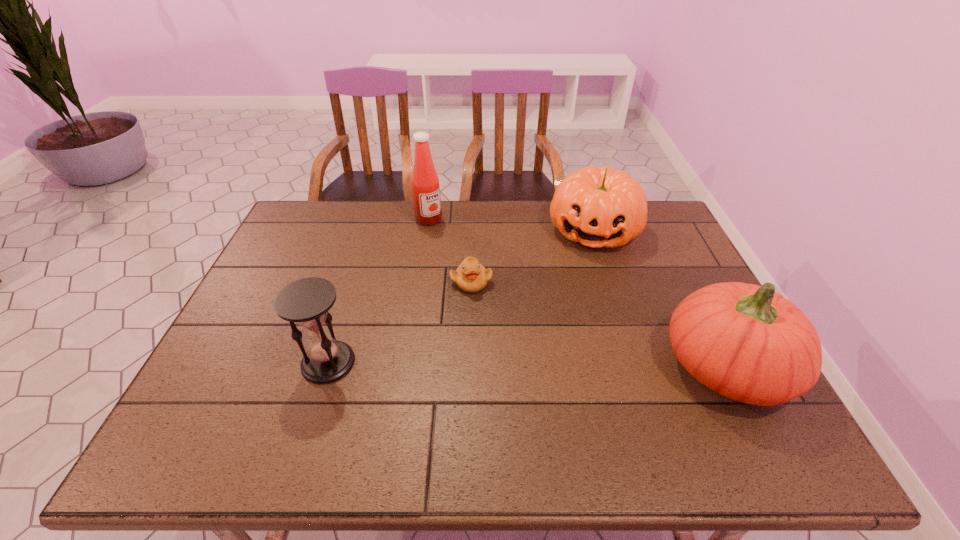
Where is `free space located 0.170m at the beak of the shortest object`? free space located 0.170m at the beak of the shortest object is located at coordinates (471, 342).

At what (x,y) coordinates should I click in order to perform the action: click on vacant space located at the beak of the shortest object. Please return your answer as a coordinate pair (x, y). The image size is (960, 540). Looking at the image, I should click on (471, 406).

At what (x,y) coordinates should I click in order to perform the action: click on vacant space situated 0.360m on the carved face of the shorter pumpkin. Please return your answer as a coordinate pair (x, y). This screenshot has height=540, width=960. Looking at the image, I should click on (570, 345).

Identify the location of vacant position located on the carved face of the shorter pumpkin. (582, 290).

Where is `vacant space located on the carved face of the shorter pumpkin`? vacant space located on the carved face of the shorter pumpkin is located at coordinates (573, 328).

Locate an element on the screen. The height and width of the screenshot is (540, 960). free space located 0.340m on the front-facing side of the second object from left to right is located at coordinates (492, 284).

Locate an element on the screen. vacant space located 0.060m on the front-facing side of the second object from left to right is located at coordinates (444, 235).

The width and height of the screenshot is (960, 540). I want to click on free point located on the front-facing side of the second object from left to right, so point(488,280).

The height and width of the screenshot is (540, 960). I want to click on pumpkin situated at the far edge, so click(x=598, y=207).

Where is `condiment present at the far edge`? The width and height of the screenshot is (960, 540). condiment present at the far edge is located at coordinates (425, 184).